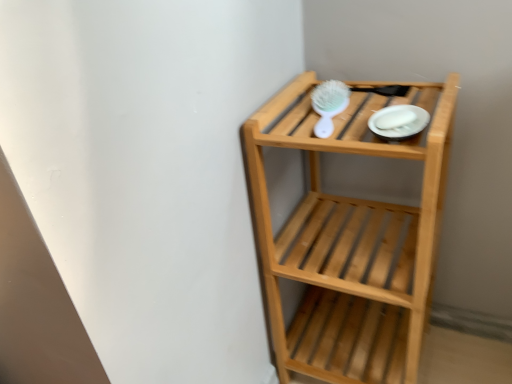
Question: Does natural wood shelf at upper right have a lesser height compared to white glossy plate at upper right?

Choices:
 (A) no
 (B) yes

Answer: (A)

Question: Is natural wood shelf at upper right to the left of white glossy plate at upper right from the viewer's perspective?

Choices:
 (A) yes
 (B) no

Answer: (B)

Question: Is natural wood shelf at upper right positioned behind white glossy plate at upper right?

Choices:
 (A) no
 (B) yes

Answer: (A)

Question: Is there a large distance between natural wood shelf at upper right and white glossy plate at upper right?

Choices:
 (A) no
 (B) yes

Answer: (A)

Question: Can you confirm if natural wood shelf at upper right is bigger than white glossy plate at upper right?

Choices:
 (A) no
 (B) yes

Answer: (B)

Question: From a real-world perspective, is natural wood shelf at upper right physically located above or below white glossy plate at upper right?

Choices:
 (A) above
 (B) below

Answer: (B)

Question: Considering the positions of natural wood shelf at upper right and white glossy plate at upper right in the image, is natural wood shelf at upper right bigger or smaller than white glossy plate at upper right?

Choices:
 (A) small
 (B) big

Answer: (B)

Question: In terms of width, does natural wood shelf at upper right look wider or thinner when compared to white glossy plate at upper right?

Choices:
 (A) wide
 (B) thin

Answer: (A)

Question: In the image, is natural wood shelf at upper right on the left side or the right side of white glossy plate at upper right?

Choices:
 (A) left
 (B) right

Answer: (B)

Question: Which is correct: white glossy plate at upper right is inside white plastic brush at upper center, or outside of it?

Choices:
 (A) inside
 (B) outside

Answer: (B)

Question: Is point (414, 109) closer or farther from the camera than point (316, 99)?

Choices:
 (A) farther
 (B) closer

Answer: (B)

Question: From the image's perspective, is white glossy plate at upper right located above or below white plastic brush at upper center?

Choices:
 (A) below
 (B) above

Answer: (A)

Question: Looking at their shapes, would you say white glossy plate at upper right is wider or thinner than white plastic brush at upper center?

Choices:
 (A) thin
 (B) wide

Answer: (A)

Question: From a real-world perspective, is natural wood shelf at upper right physically located above or below white plastic brush at upper center?

Choices:
 (A) above
 (B) below

Answer: (B)

Question: In terms of width, does natural wood shelf at upper right look wider or thinner when compared to white plastic brush at upper center?

Choices:
 (A) thin
 (B) wide

Answer: (B)